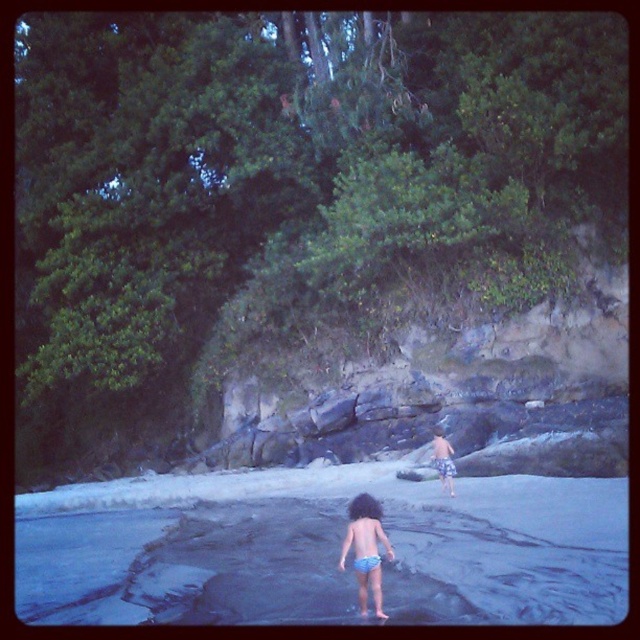
Question: Which object appears farthest from the camera in this image?

Choices:
 (A) blue striped shorts at center
 (B) blue rubber water at center
 (C) blue denim shorts at center

Answer: (A)

Question: Which point is farther to the camera?

Choices:
 (A) (436, 442)
 (B) (358, 518)

Answer: (A)

Question: Which of the following is the farthest from the observer?

Choices:
 (A) blue denim shorts at center
 (B) blue rubber water at center

Answer: (A)

Question: From the image, what is the correct spatial relationship of blue rubber water at center in relation to blue denim shorts at center?

Choices:
 (A) below
 (B) above

Answer: (A)

Question: Does blue rubber water at center lie behind blue denim shorts at center?

Choices:
 (A) no
 (B) yes

Answer: (A)

Question: Can you confirm if blue denim shorts at center is thinner than blue striped shorts at center?

Choices:
 (A) yes
 (B) no

Answer: (B)